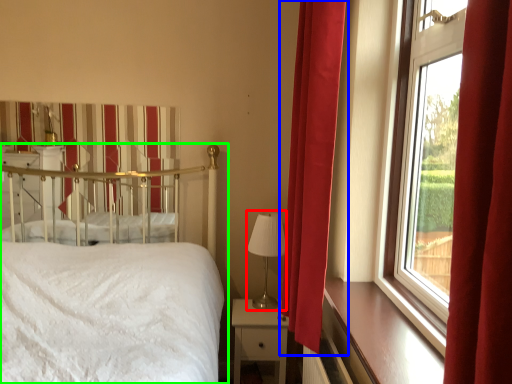
Question: Estimate the real-world distances between objects in this image. Which object is closer to table lamp (highlighted by a red box), curtain (highlighted by a blue box) or bed (highlighted by a green box)?

Choices:
 (A) curtain
 (B) bed

Answer: (A)